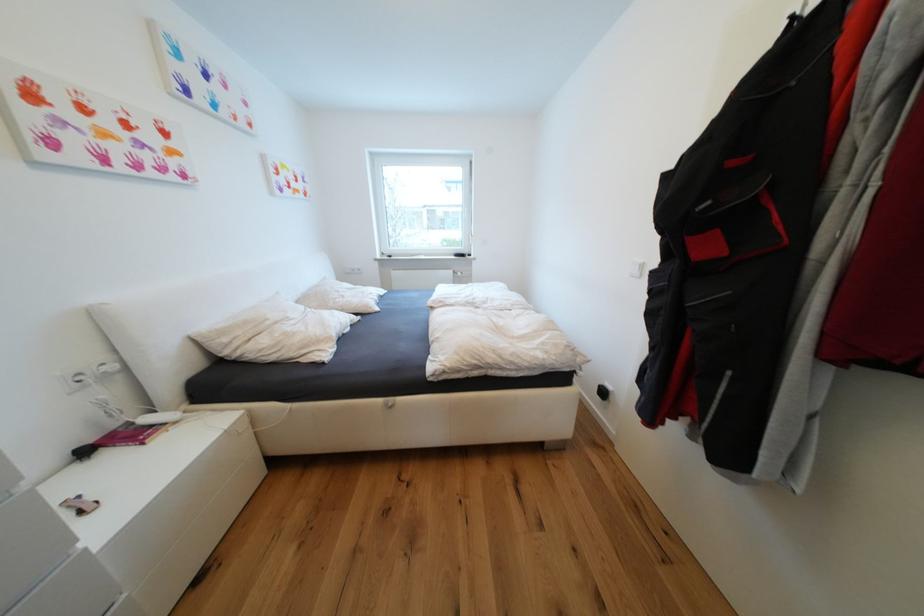
Find where to pull the white wall plug. Please return your answer as a coordinate pair (x, y).

(110, 368)